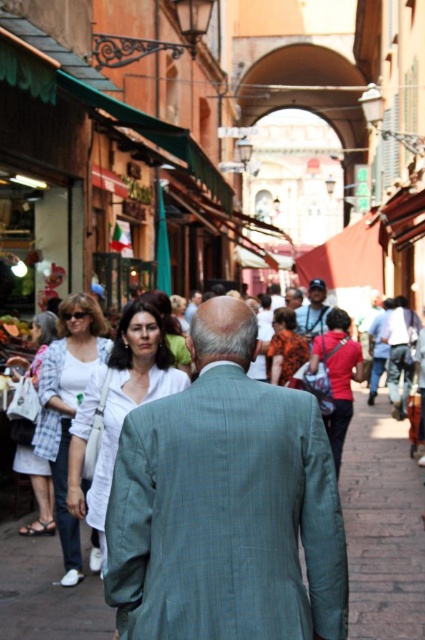
You are a photographer trying to capture both the green plaid suit at center and the white cotton shirt at left in a single frame. Based on their heights, which one should you focus on first to ensure both are in focus?

The green plaid suit at center has a lesser height compared to white cotton shirt at left, so you should focus on the white cotton shirt at left first to ensure both are in focus.

You are a photographer standing in the middle of the street. You want to take a photo that includes both the white matte shirt at center and the orange floral dress at center. Which direction should you move to ensure both are in frame?

You should move to the right so that both the white matte shirt at center and the orange floral dress at center are visible in the frame since the white matte shirt at center is to the left of the orange floral dress at center.

Based on the photo, you are standing on the street and want to determine which of the two points, point [212,305] or point [322,324], is closer to you. Based on the scene, can you identify the closer point?

Point [212,305] is closer to the viewer than point [322,324].